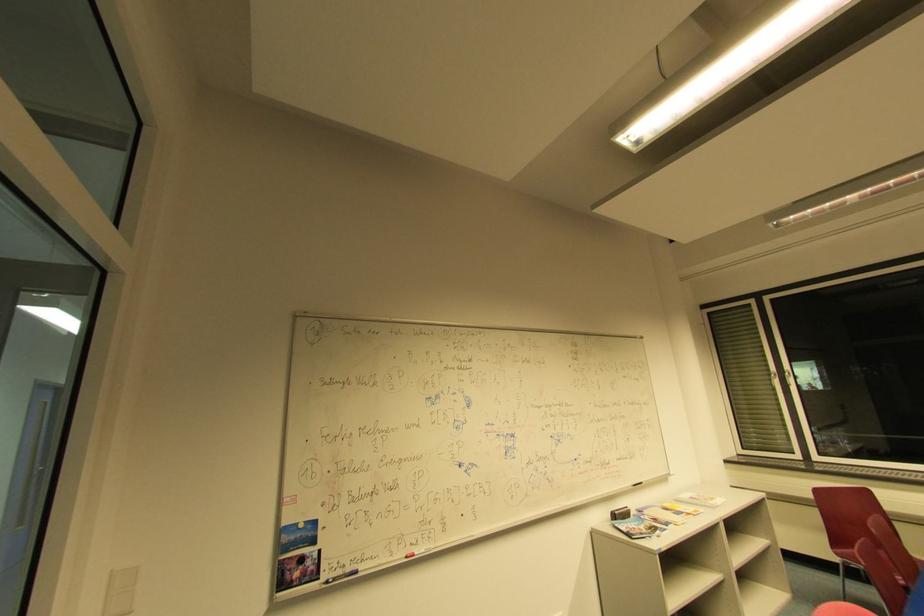
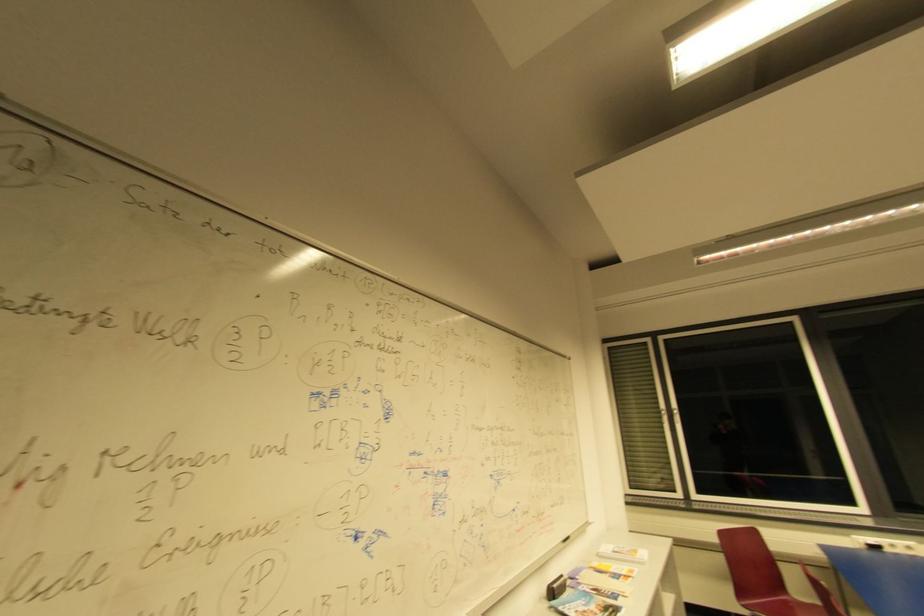
Where in the second image is the point corresponding to point 715,500 from the first image?

(640, 553)